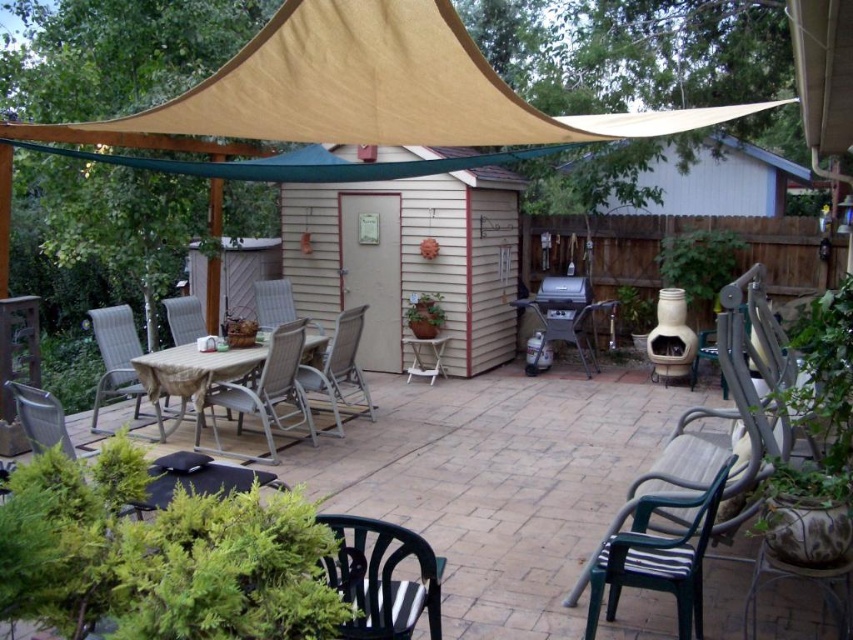
Find the location of `metallic silver chair at center`. metallic silver chair at center is located at coordinates (339, 369).

Can you confirm if metallic silver chair at center is shorter than woven plastic chair at center?

In fact, metallic silver chair at center may be taller than woven plastic chair at center.

Is point (358, 380) in front of point (294, 310)?

Yes, it is in front of point (294, 310).

At what (x,y) coordinates should I click in order to perform the action: click on metallic silver chair at center. Please return your answer as a coordinate pair (x, y). The height and width of the screenshot is (640, 853). Looking at the image, I should click on (339, 369).

Does black plastic chair at lower center have a lesser height compared to metallic silver chair at center?

Correct, black plastic chair at lower center is not as tall as metallic silver chair at center.

Can you confirm if black plastic chair at lower center is bigger than metallic silver chair at center?

No, black plastic chair at lower center is not bigger than metallic silver chair at center.

The image size is (853, 640). In order to click on black plastic chair at lower center in this screenshot , I will do `click(381, 579)`.

The image size is (853, 640). What do you see at coordinates (659, 557) in the screenshot? I see `green plastic chair at lower right` at bounding box center [659, 557].

Is green plastic chair at lower right above metallic silver chair at center?

Actually, green plastic chair at lower right is below metallic silver chair at center.

Who is more forward, (721, 488) or (341, 312)?

Positioned in front is point (721, 488).

Where is `green plastic chair at lower right`? Image resolution: width=853 pixels, height=640 pixels. green plastic chair at lower right is located at coordinates (659, 557).